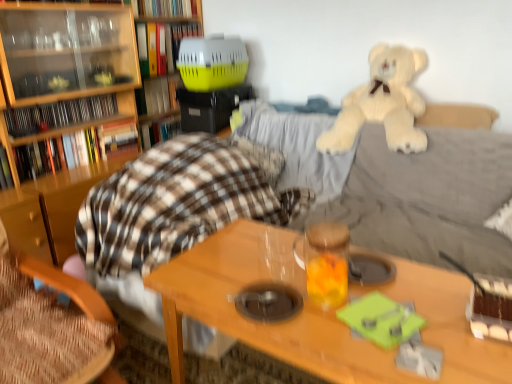
Image resolution: width=512 pixels, height=384 pixels. Identify the location of vacant area on top of wooden table at center (from a real-world perspective). [x=340, y=296].